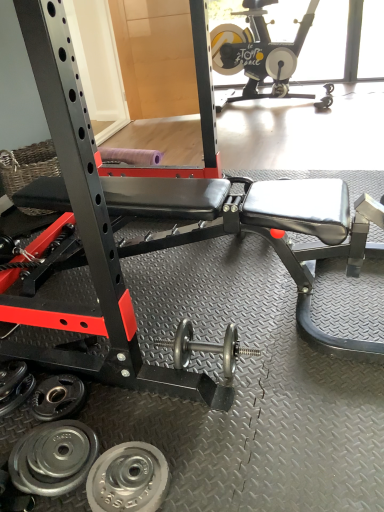
Question: Does silver metallic weight plate at lower left, which ranks as the first wheel in front-to-back order, have a lesser height compared to polished silver dumbbell at center?

Choices:
 (A) no
 (B) yes

Answer: (B)

Question: Is silver metallic weight plate at lower left, which ranks as the first wheel in front-to-back order, further to camera compared to polished silver dumbbell at center?

Choices:
 (A) yes
 (B) no

Answer: (B)

Question: Is silver metallic weight plate at lower left, which ranks as the first wheel in front-to-back order, next to polished silver dumbbell at center and touching it?

Choices:
 (A) yes
 (B) no

Answer: (B)

Question: Considering the relative sizes of silver metallic weight plate at lower left, the third wheel positioned from the back, and polished silver dumbbell at center in the image provided, is silver metallic weight plate at lower left, the third wheel positioned from the back, taller than polished silver dumbbell at center?

Choices:
 (A) no
 (B) yes

Answer: (A)

Question: Does silver metallic weight plate at lower left, which ranks as the first wheel in front-to-back order, appear on the right side of polished silver dumbbell at center?

Choices:
 (A) no
 (B) yes

Answer: (A)

Question: From a real-world perspective, is silver metallic weight plate at lower left, which ranks as the second wheel in front-to-back order, above or below polished silver dumbbell at center?

Choices:
 (A) above
 (B) below

Answer: (B)

Question: Do you think silver metallic weight plate at lower left, which ranks as the second wheel in front-to-back order, is within polished silver dumbbell at center, or outside of it?

Choices:
 (A) outside
 (B) inside

Answer: (A)

Question: From their relative heights in the image, would you say silver metallic weight plate at lower left, which ranks as the second wheel in back-to-front order, is taller or shorter than polished silver dumbbell at center?

Choices:
 (A) tall
 (B) short

Answer: (B)

Question: Is point (89, 437) positioned closer to the camera than point (231, 338)?

Choices:
 (A) farther
 (B) closer

Answer: (B)

Question: Is point (286, 53) closer or farther from the camera than point (84, 394)?

Choices:
 (A) farther
 (B) closer

Answer: (A)

Question: From the image's perspective, relative to silver metallic weight plate at lower left, arranged as the 3th wheel when viewed from the front, is black matte stationary bike at upper right above or below?

Choices:
 (A) below
 (B) above

Answer: (B)

Question: Relative to silver metallic weight plate at lower left, arranged as the 3th wheel when viewed from the front, is black matte stationary bike at upper right in front or behind?

Choices:
 (A) behind
 (B) front

Answer: (A)

Question: Considering the positions of black matte stationary bike at upper right and silver metallic weight plate at lower left, arranged as the 3th wheel when viewed from the front, in the image, is black matte stationary bike at upper right bigger or smaller than silver metallic weight plate at lower left, arranged as the 3th wheel when viewed from the front,?

Choices:
 (A) big
 (B) small

Answer: (A)

Question: Considering the positions of silver metallic weight plate at lower left, which ranks as the 1th wheel in back-to-front order, and polished silver dumbbell at center in the image, is silver metallic weight plate at lower left, which ranks as the 1th wheel in back-to-front order, taller or shorter than polished silver dumbbell at center?

Choices:
 (A) tall
 (B) short

Answer: (B)

Question: Looking at their shapes, would you say silver metallic weight plate at lower left, arranged as the 3th wheel when viewed from the front, is wider or thinner than polished silver dumbbell at center?

Choices:
 (A) thin
 (B) wide

Answer: (A)